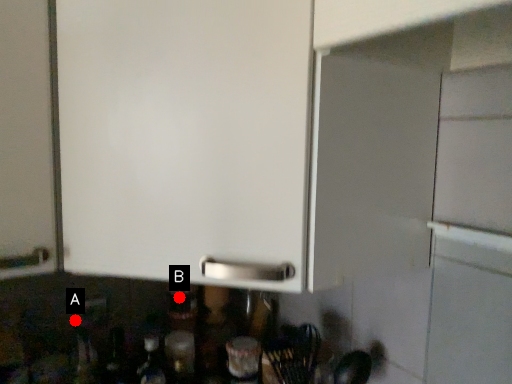
Question: Two points are circled on the image, labeled by A and B beside each circle. Which point is closer to the camera?

Choices:
 (A) A is closer
 (B) B is closer

Answer: (A)